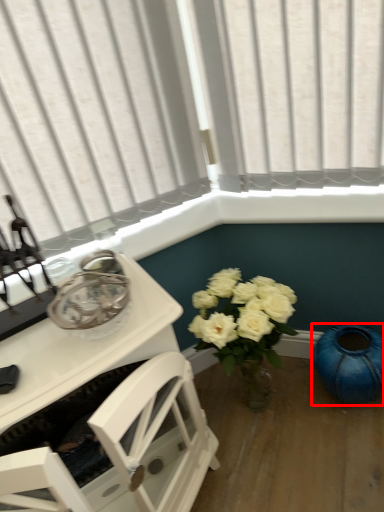
Question: From the image's perspective, considering the relative positions of teal (annotated by the red box) and table in the image provided, where is teal (annotated by the red box) located with respect to the staircase?

Choices:
 (A) below
 (B) above

Answer: (A)